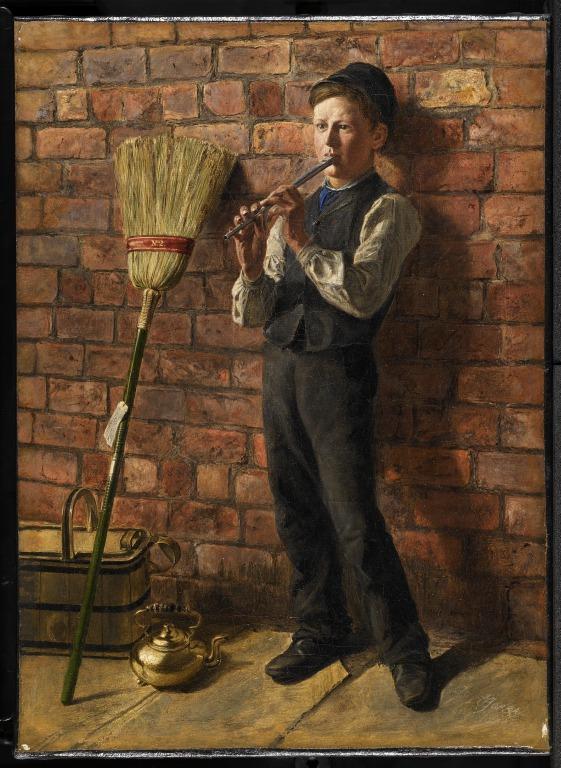
You are a GUI agent. You are given a task and a screenshot of the screen. Output one action in this format:
    pyautogui.click(x=<x>, y=<y>)
    Task: Click on the teapot
    This screenshot has width=561, height=768.
    Given the screenshot: What is the action you would take?
    pyautogui.click(x=172, y=653)